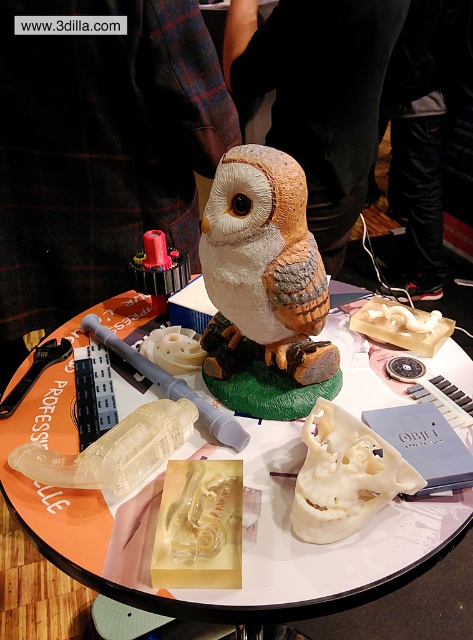
Question: Which point is closer to the camera taking this photo?

Choices:
 (A) (411, 516)
 (B) (323, 364)

Answer: (A)

Question: In this image, where is translucent plastic skull at center located relative to matte clay owl at center?

Choices:
 (A) below
 (B) above

Answer: (A)

Question: Can you confirm if translucent plastic skull at center is positioned above matte clay owl at center?

Choices:
 (A) no
 (B) yes

Answer: (A)

Question: Can you confirm if translucent plastic skull at center is thinner than matte clay owl at center?

Choices:
 (A) yes
 (B) no

Answer: (B)